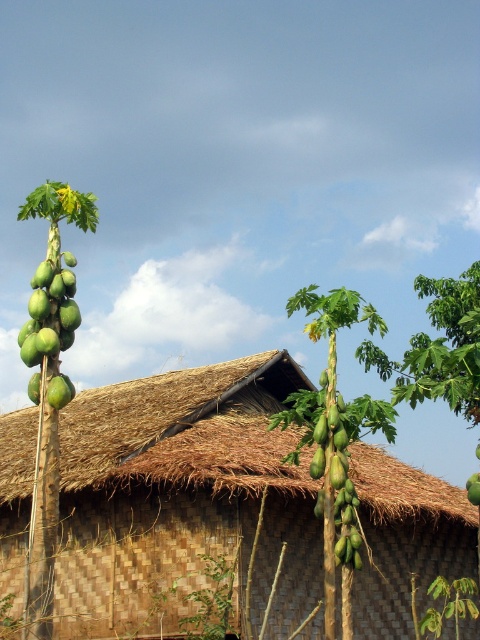
Is point (75, 326) closer to camera compared to point (62, 390)?

No, it is behind (62, 390).

Is green papaya tree at left smaller than green matte papaya at left?

No, green papaya tree at left is not smaller than green matte papaya at left.

Is point (20, 209) positioned behind point (24, 355)?

Yes, point (20, 209) is farther from viewer.

In order to click on green papaya tree at left in this screenshot , I will do `click(48, 381)`.

Does point (141, 420) come farther from viewer compared to point (76, 202)?

Yes, point (141, 420) is farther from viewer.

Measure the distance between brown thatch at center and green papaya tree at left.

The distance of brown thatch at center from green papaya tree at left is 17.91 feet.

Measure the distance between point (165,403) and camera.

Point (165,403) and camera are 22.87 meters apart.

Locate an element on the screen. The height and width of the screenshot is (640, 480). brown thatch at center is located at coordinates (186, 429).

Is brown thatch at center taller than green matte papaya at left?

Correct, brown thatch at center is much taller as green matte papaya at left.

Can you confirm if brown thatch at center is bigger than green matte papaya at left?

Yes, brown thatch at center is bigger than green matte papaya at left.

Who is more distant from viewer, (223, 401) or (45, 275)?

Positioned behind is point (223, 401).

Where is `brown thatch at center`? The width and height of the screenshot is (480, 640). brown thatch at center is located at coordinates click(186, 429).